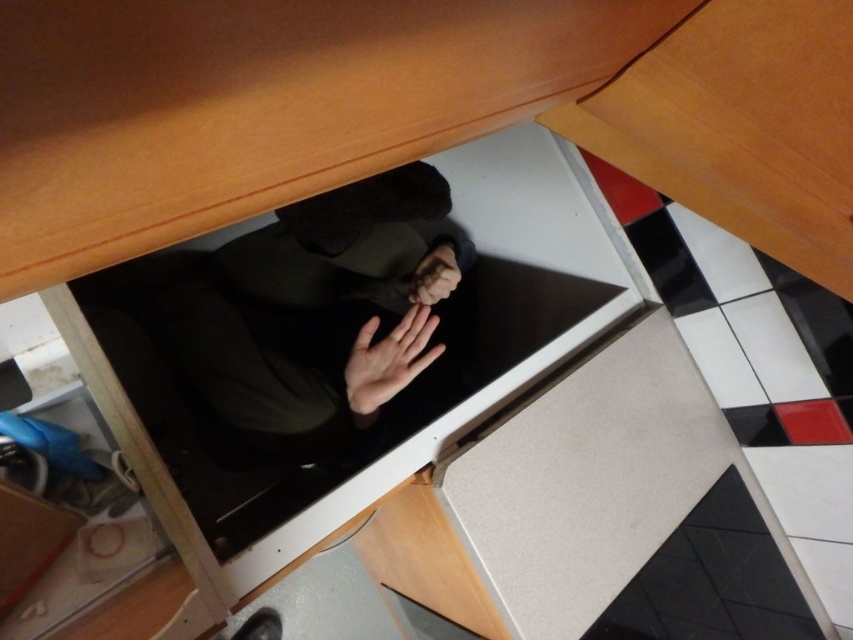
You are organizing items on the kitchen counter and notice the black matte laptop at center and the matte black hand at center. Which item is closer to you as you face the counter?

The black matte laptop at center is closer to you because it is in front of the matte black hand at center.

Looking at this image, you are organizing a small workspace in the kitchen and have both the black matte laptop at center and the matte black hand at center. Which object takes up more space?

The black matte laptop at center is bigger than the matte black hand at center, so it takes up more space.